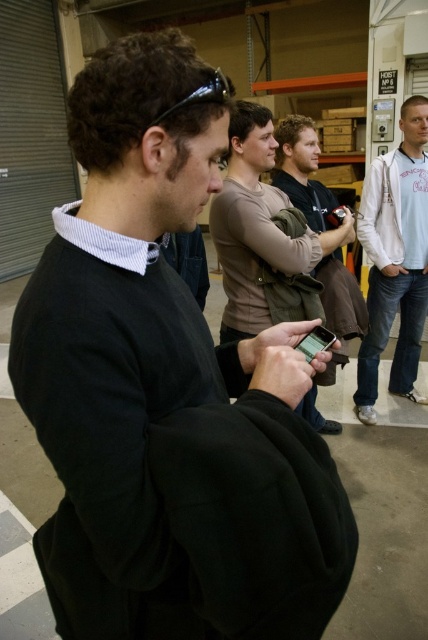
You are standing in the warehouse and see two points marked in the image. Which point is closer to you, point (422, 228) or point (327, 337)?

Point (327, 337) is closer to you because it is less far from the camera than point (422, 228).

Please describe the location of the brown leather jacket at center in terms of coordinates within the image. The coordinates should be in the format of a point with two decimal places, such as point (318, 224).

The brown leather jacket at center is located at point (318, 224).